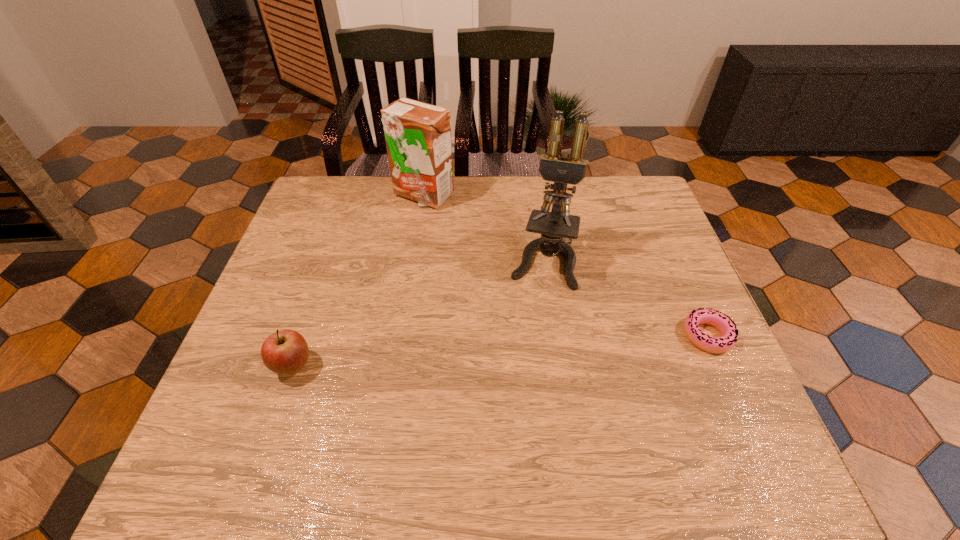
Locate an element on the screen. This screenshot has height=540, width=960. object positioned at the near left corner is located at coordinates (285, 352).

Find the location of `vacant space at the far edge`. vacant space at the far edge is located at coordinates (536, 183).

The image size is (960, 540). In the image, there is a desktop. Find the location of `blank space at the near edge`. blank space at the near edge is located at coordinates (552, 406).

The image size is (960, 540). I want to click on vacant space at the left edge, so click(351, 224).

The height and width of the screenshot is (540, 960). Identify the location of free space at the right edge of the desktop. (663, 360).

I want to click on free location at the far left corner of the desktop, so click(x=350, y=186).

I want to click on vacant space at the near left corner of the desktop, so click(246, 423).

The width and height of the screenshot is (960, 540). In the image, there is a desktop. Identify the location of vacant region at the far right corner. (636, 186).

The height and width of the screenshot is (540, 960). I want to click on vacant space in between the rightmost object and the microscope, so click(625, 298).

In order to click on free area in between the second farthest object and the third object from right to left in this screenshot , I will do `click(483, 228)`.